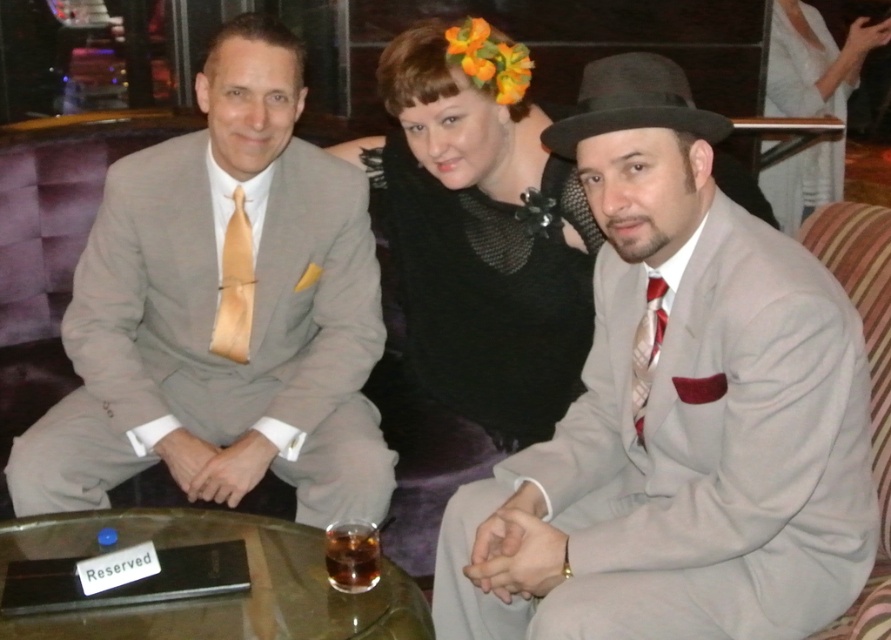
You are standing in the bar and want to hand a drink to the person sitting at the point labeled as point (644, 164). Can you reach them without moving closer than 1 meter?

The distance between you and the person at point (644, 164) is 1.17 meters, which is more than 1 meter. Therefore, you cannot reach them without moving closer.

You are taking a photo of two points in the scene. The first point is at coordinates point (737, 355) and the second point is at point (634, 356). Which point will appear larger in your photo?

Point (737, 355) is closer to the camera than point (634, 356), so it will appear larger in the photo.

You are a photographer at the event and want to capture a photo of the white satin dress at upper right and the satin gold tie at left. Since the camera can only focus on one subject at a time, which one should you adjust the focus to first if you want to ensure the subject closer to the camera is sharp?

The white satin dress at upper right is to the right of the satin gold tie at left. Since the camera focuses on the nearest subject first, you should adjust the focus to the satin gold tie at left first as it is closer to the camera.